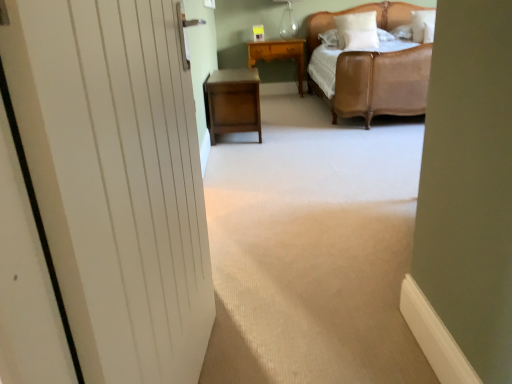
Identify the location of vacant space to the right of wooden nightstand at center, positioned as the first nightstand in bottom-to-top order. (300, 126).